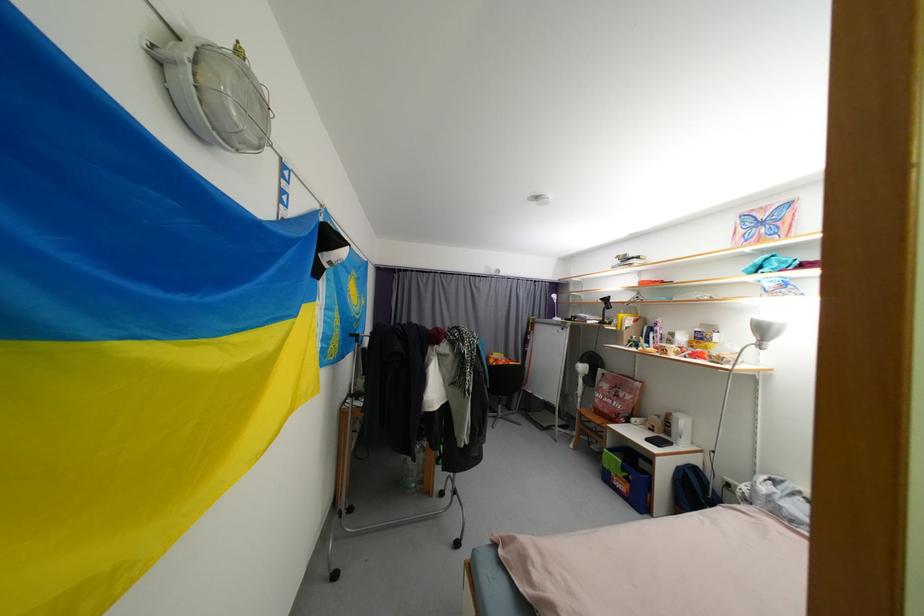
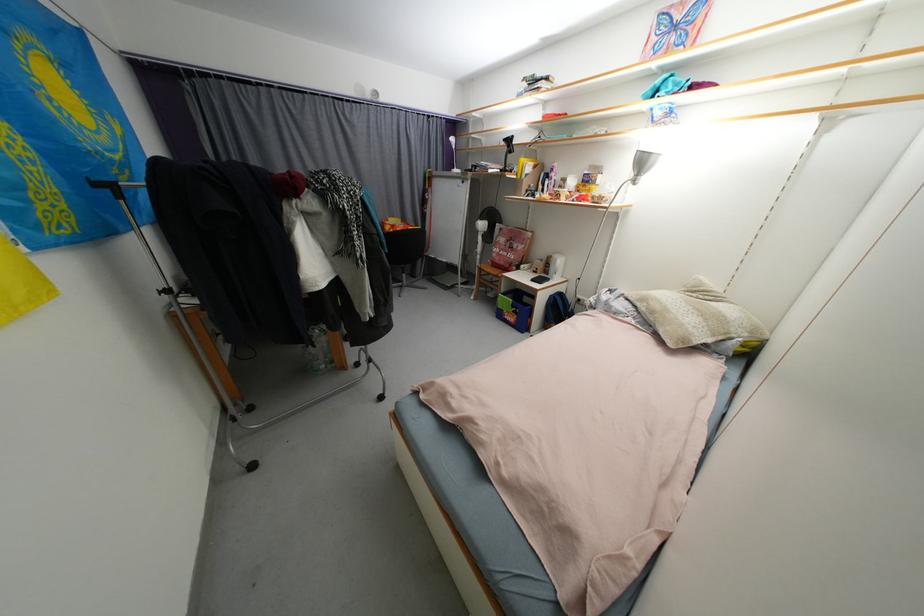
Consider the image. The first image is from the beginning of the video and the second image is from the end. How did the camera likely rotate when shooting the video?

The camera's rotation is toward right-down.